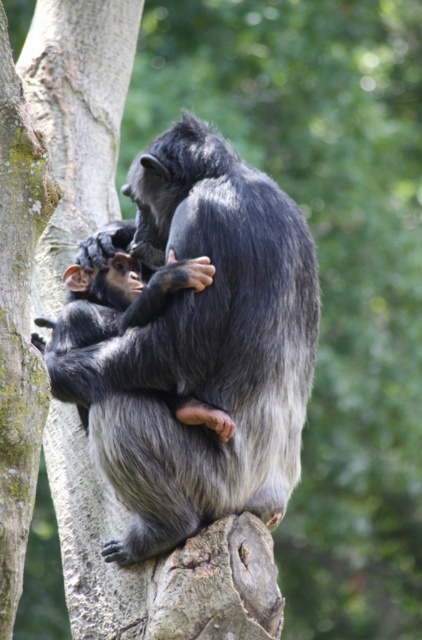
Who is lower down, gray furry monkey at center or shiny black monkey at center?

shiny black monkey at center is below.

Which is above, gray furry monkey at center or shiny black monkey at center?

gray furry monkey at center is above.

Locate an element on the screen. Image resolution: width=422 pixels, height=640 pixels. gray furry monkey at center is located at coordinates click(x=199, y=348).

Image resolution: width=422 pixels, height=640 pixels. What are the coordinates of `gray furry monkey at center` in the screenshot? It's located at (199, 348).